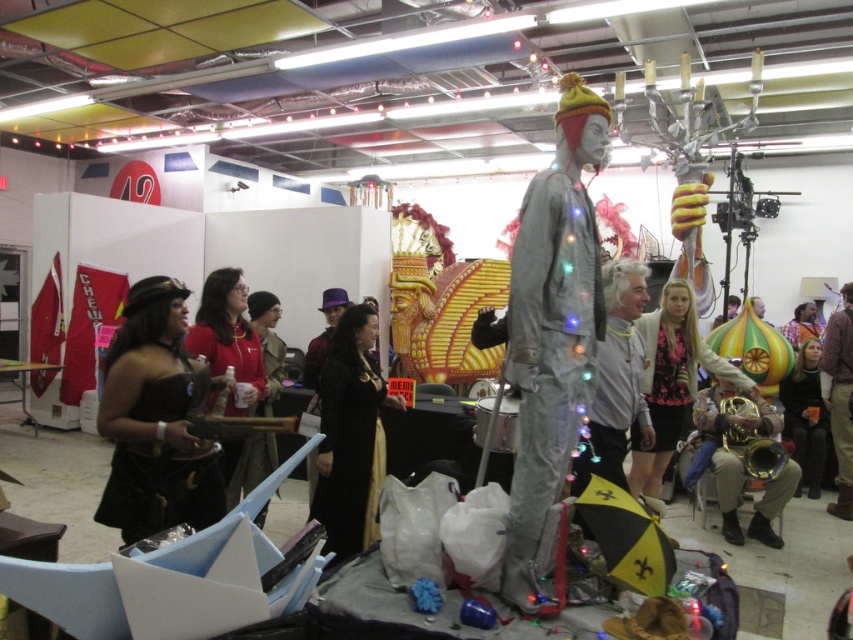
You are at an event and want to take a photo of the shiny metallic mannequin at center without getting too close. If your camera has a maximum zoom range that allows you to focus clearly from 7 feet away, can you take a clear photo from your current position?

The shiny metallic mannequin at center is 7.11 feet away from viewer. Since the camera can focus clearly up to 7 feet, the distance is slightly beyond the camera limit, so the photo may not be clear unless you move closer or use additional zoom.

You are at the event and want to approach the person in the floral fabric dress at center and the person in the brown leather jacket at right. Which one would you reach first?

The floral fabric dress at center is closer to the viewer than the brown leather jacket at right, so you would reach the person in the floral fabric dress at center first.

You are at the event and want to move from your current position to the exit located at point (675, 380). There is an obstacle at point (622, 445). Can you walk around the obstacle to reach the exit?

Point (622, 445) is in front of point (675, 380), so the obstacle is blocking the path to the exit. You will need to find an alternative route to reach the exit.